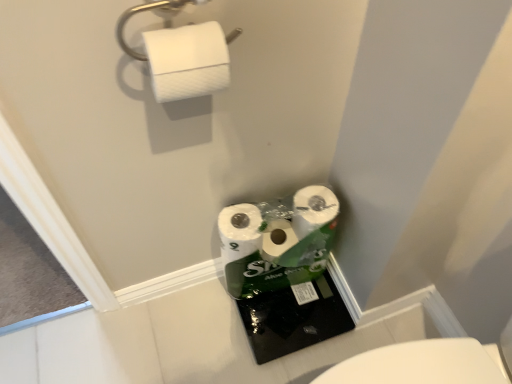
Question: Does white textured toilet paper at upper left have a lesser height compared to white matte paper towel at upper left?

Choices:
 (A) yes
 (B) no

Answer: (A)

Question: Is white matte paper towel at upper left located within white textured toilet paper at upper left?

Choices:
 (A) yes
 (B) no

Answer: (B)

Question: Is white textured toilet paper at upper left wider than white matte paper towel at upper left?

Choices:
 (A) no
 (B) yes

Answer: (B)

Question: Is white textured toilet paper at upper left facing away from white matte paper towel at upper left?

Choices:
 (A) no
 (B) yes

Answer: (A)

Question: From the image's perspective, is white textured toilet paper at upper left beneath white matte paper towel at upper left?

Choices:
 (A) no
 (B) yes

Answer: (B)

Question: Is white textured toilet paper at upper left taller than white matte paper towel at upper left?

Choices:
 (A) no
 (B) yes

Answer: (A)

Question: Considering the relative sizes of white matte paper towel at upper left and white textured toilet paper at upper left in the image provided, is white matte paper towel at upper left shorter than white textured toilet paper at upper left?

Choices:
 (A) yes
 (B) no

Answer: (B)

Question: Can you confirm if white matte paper towel at upper left is thinner than white textured toilet paper at upper left?

Choices:
 (A) yes
 (B) no

Answer: (A)

Question: From a real-world perspective, is white matte paper towel at upper left on white textured toilet paper at upper left?

Choices:
 (A) no
 (B) yes

Answer: (B)

Question: Is white matte paper towel at upper left oriented towards white textured toilet paper at upper left?

Choices:
 (A) no
 (B) yes

Answer: (A)

Question: Considering the relative sizes of white matte paper towel at upper left and white textured toilet paper at upper left in the image provided, is white matte paper towel at upper left bigger than white textured toilet paper at upper left?

Choices:
 (A) yes
 (B) no

Answer: (B)

Question: From the image's perspective, is white matte paper towel at upper left on white textured toilet paper at upper left?

Choices:
 (A) yes
 (B) no

Answer: (A)

Question: From the image's perspective, is white textured toilet paper at upper left positioned above or below white matte paper towel at upper left?

Choices:
 (A) below
 (B) above

Answer: (A)